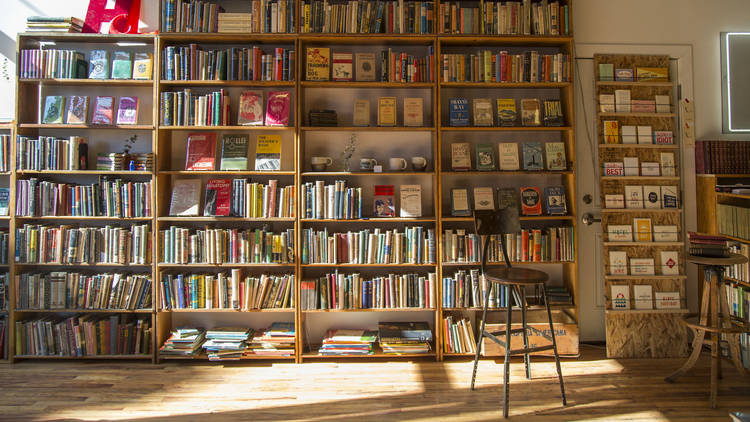
You are a GUI agent. You are given a task and a screenshot of the screen. Output one action in this format:
    pyautogui.click(x=<x>, y=<y>)
    Task: Click on the window
    
    Given the screenshot: What is the action you would take?
    pyautogui.click(x=742, y=75)